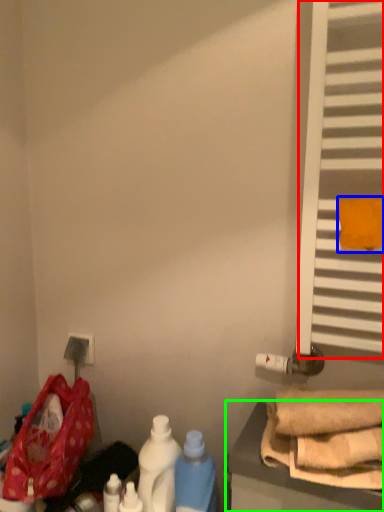
Question: Estimate the real-world distances between objects in this image. Which object is closer to window (highlighted by a red box), beach towel (highlighted by a blue box) or furniture (highlighted by a green box)?

Choices:
 (A) beach towel
 (B) furniture

Answer: (A)